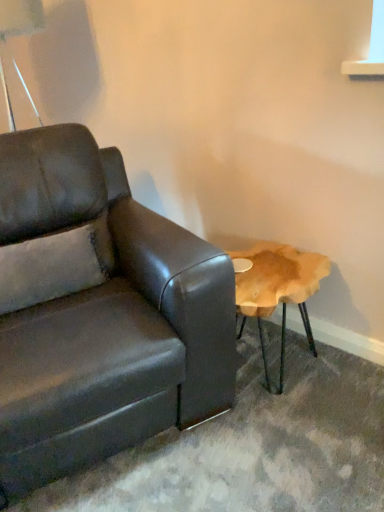
Question: Does metallic silver table lamp at upper left have a lesser width compared to matte leather couch at left?

Choices:
 (A) yes
 (B) no

Answer: (A)

Question: Considering the relative positions of metallic silver table lamp at upper left and matte leather couch at left in the image provided, is metallic silver table lamp at upper left in front of matte leather couch at left?

Choices:
 (A) yes
 (B) no

Answer: (B)

Question: Can you confirm if metallic silver table lamp at upper left is positioned to the right of matte leather couch at left?

Choices:
 (A) no
 (B) yes

Answer: (A)

Question: Does metallic silver table lamp at upper left have a greater width compared to matte leather couch at left?

Choices:
 (A) no
 (B) yes

Answer: (A)

Question: Is metallic silver table lamp at upper left turned away from matte leather couch at left?

Choices:
 (A) yes
 (B) no

Answer: (B)

Question: Does metallic silver table lamp at upper left appear on the left side of matte leather couch at left?

Choices:
 (A) yes
 (B) no

Answer: (A)

Question: Is matte leather couch at left aimed at metallic silver table lamp at upper left?

Choices:
 (A) no
 (B) yes

Answer: (A)

Question: Does matte leather couch at left have a larger size compared to metallic silver table lamp at upper left?

Choices:
 (A) yes
 (B) no

Answer: (A)

Question: From the image's perspective, is matte leather couch at left above metallic silver table lamp at upper left?

Choices:
 (A) no
 (B) yes

Answer: (A)

Question: Considering the relative sizes of matte leather couch at left and metallic silver table lamp at upper left in the image provided, is matte leather couch at left thinner than metallic silver table lamp at upper left?

Choices:
 (A) yes
 (B) no

Answer: (B)

Question: Is matte leather couch at left oriented away from metallic silver table lamp at upper left?

Choices:
 (A) no
 (B) yes

Answer: (A)

Question: Is matte leather couch at left closer to the viewer compared to metallic silver table lamp at upper left?

Choices:
 (A) no
 (B) yes

Answer: (B)

Question: Looking at their shapes, would you say matte leather couch at left is wider or thinner than metallic silver table lamp at upper left?

Choices:
 (A) wide
 (B) thin

Answer: (A)